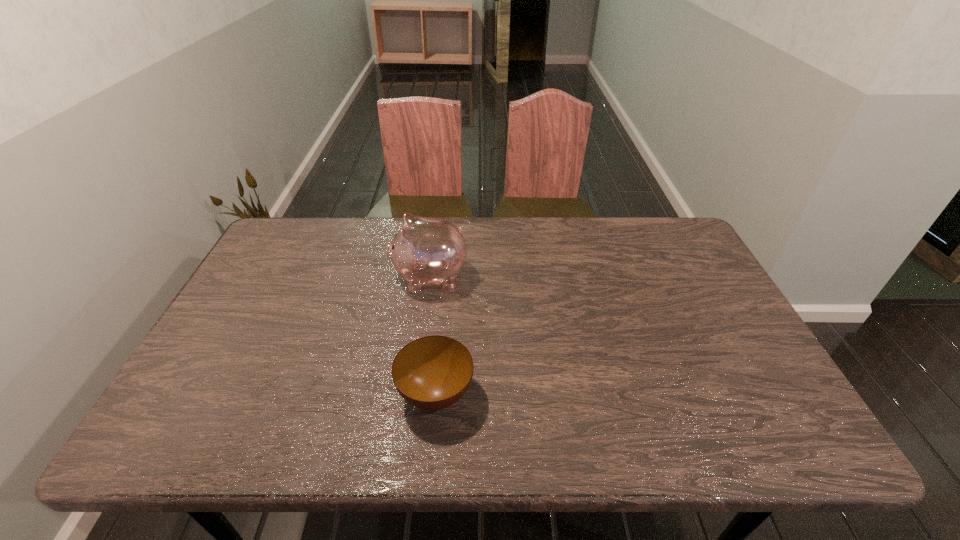
Find the location of a particular element. The height and width of the screenshot is (540, 960). free space at the far edge of the desktop is located at coordinates (540, 220).

Locate an element on the screen. The height and width of the screenshot is (540, 960). free space at the near edge is located at coordinates (513, 417).

The image size is (960, 540). I want to click on vacant space at the left edge of the desktop, so click(x=264, y=357).

In the image, there is a desktop. Identify the location of free region at the far left corner. This screenshot has width=960, height=540. (301, 242).

The height and width of the screenshot is (540, 960). In the image, there is a desktop. Identify the location of vacant space at the far right corner. (665, 231).

Where is `vacant region that satisfies the following two spatial constraints: 1. on the front facing side of the shorter object; 2. on the right side of the piggy bank`? The image size is (960, 540). vacant region that satisfies the following two spatial constraints: 1. on the front facing side of the shorter object; 2. on the right side of the piggy bank is located at coordinates (415, 394).

In order to click on vacant region that satisfies the following two spatial constraints: 1. on the front facing side of the shorter object; 2. on the right side of the farther object in this screenshot , I will do `click(415, 394)`.

Image resolution: width=960 pixels, height=540 pixels. I want to click on blank space that satisfies the following two spatial constraints: 1. on the front facing side of the nearer object; 2. on the right side of the farther object, so click(415, 394).

In order to click on vacant space that satisfies the following two spatial constraints: 1. on the front facing side of the taller object; 2. on the right side of the nearer object in this screenshot , I will do `click(415, 394)`.

At what (x,y) coordinates should I click in order to perform the action: click on vacant space that satisfies the following two spatial constraints: 1. on the front facing side of the farther object; 2. on the right side of the bowl. Please return your answer as a coordinate pair (x, y). This screenshot has height=540, width=960. Looking at the image, I should click on (415, 394).